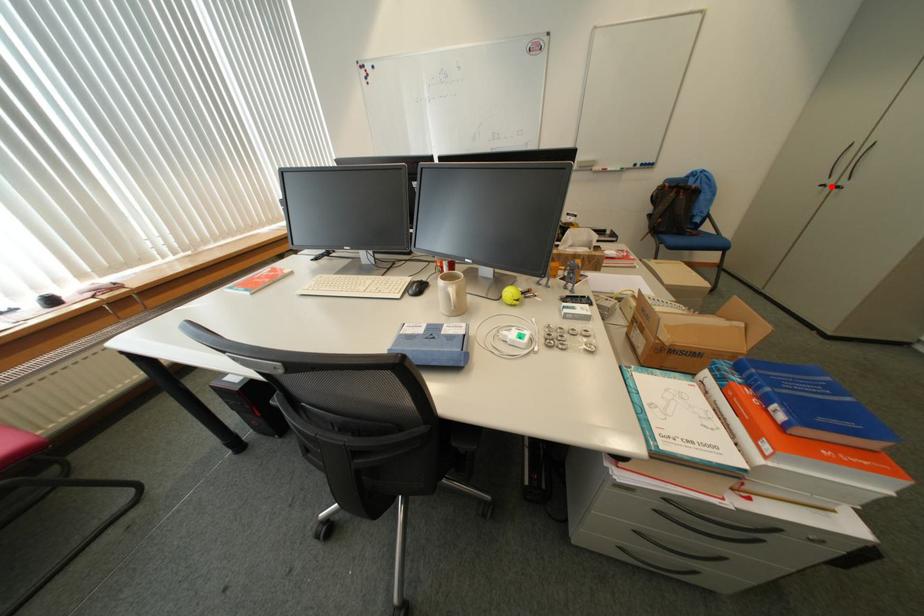
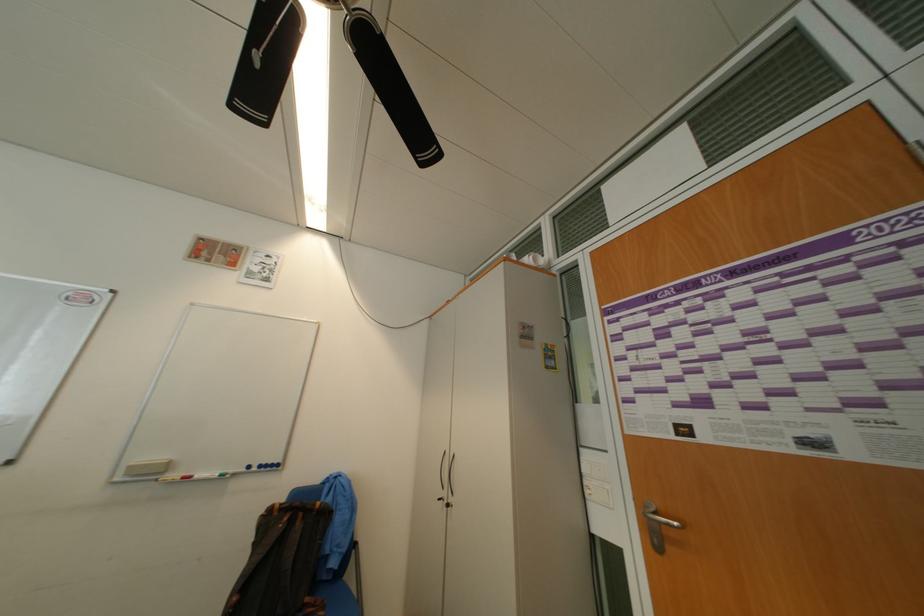
Locate, in the second image, the point that corresponds to the highlighted location in the first image.

(448, 501)